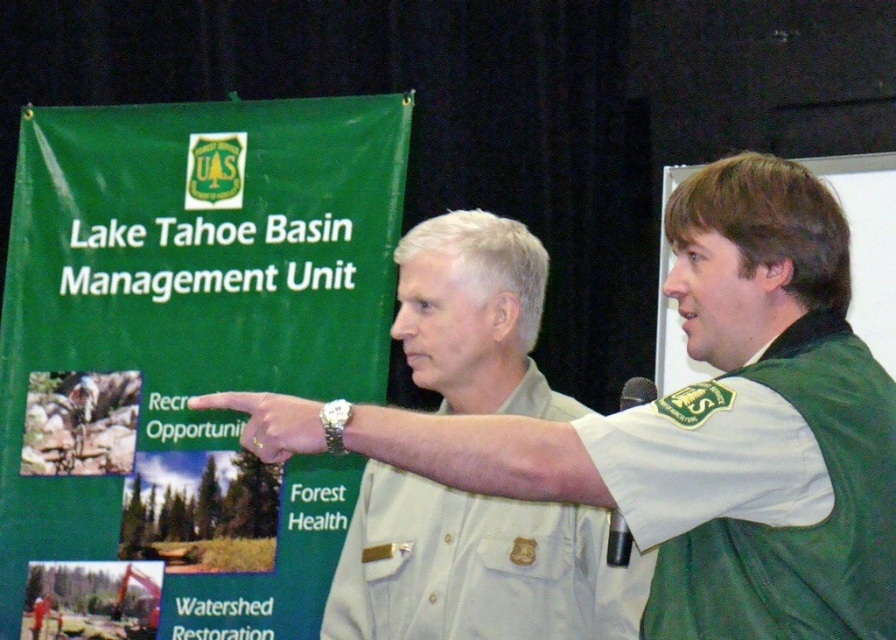
You are a photographer trying to capture a group photo of the white cotton shirt at center and the green fabric vest at right. What is the minimum distance you need to stand back to ensure both are fully in frame?

The white cotton shirt at center and green fabric vest at right are 5.69 meters apart from each other. To capture both in the frame, you need to stand at least 5.69 meters away to ensure they are fully visible.

You are a visitor at the Lake Tahoe Basin Management Unit event. You see the white cotton shirt at center and the green fabric vest at right. Which person is closer to you?

The white cotton shirt at center is closer to you because it is in front of the green fabric vest at right.

You are a visitor at the Lake Tahoe Basin Management Unit event and want to take a photo with the green fabric poster at left and the green fabric vest at right. Which object should you stand closer to if you want both to be fully visible in your photo?

You should stand closer to the green fabric vest at right because the green fabric poster at left might be wider than the green fabric vest at right, so moving closer to the smaller object helps include both in the frame.